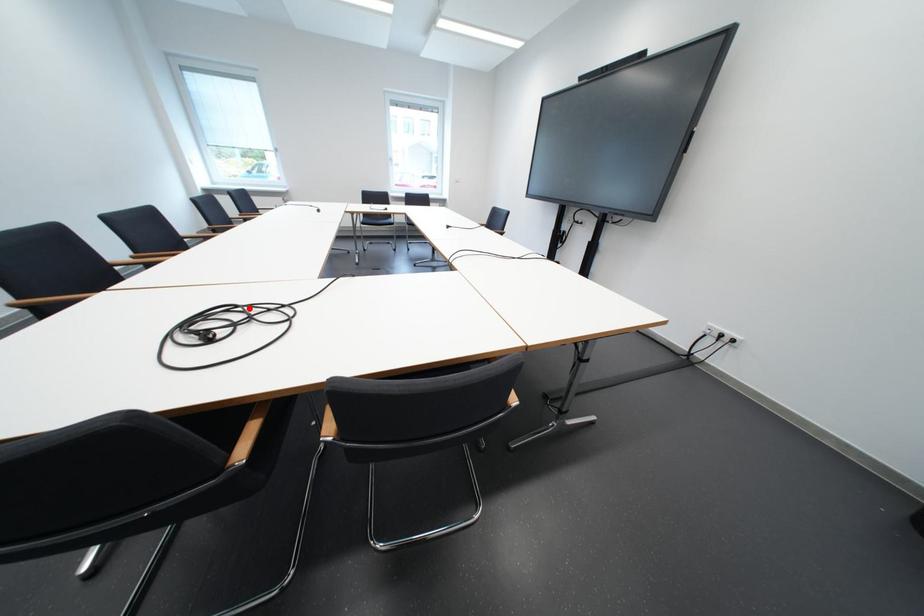
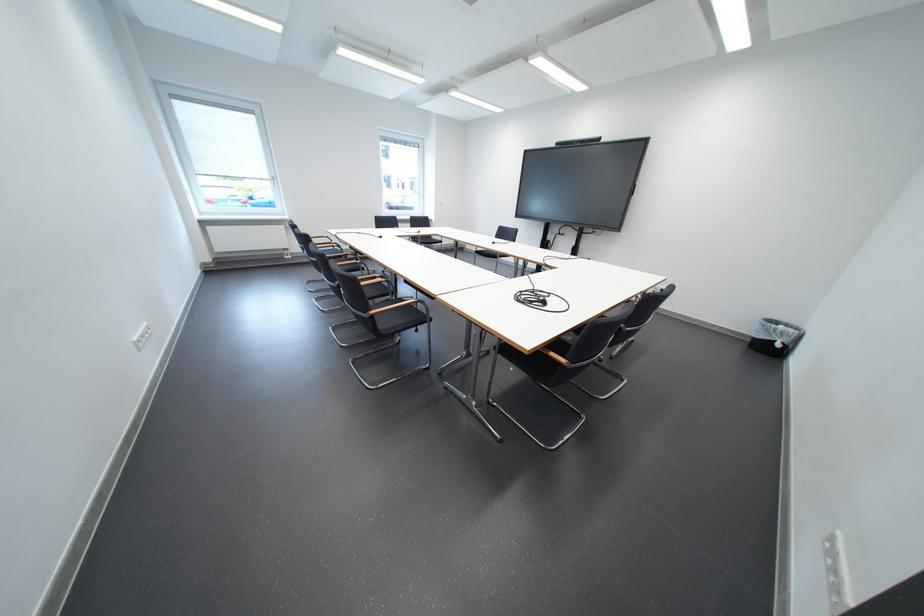
Where in the second image is the point corresponding to the highlighted location from the first image?

(533, 294)